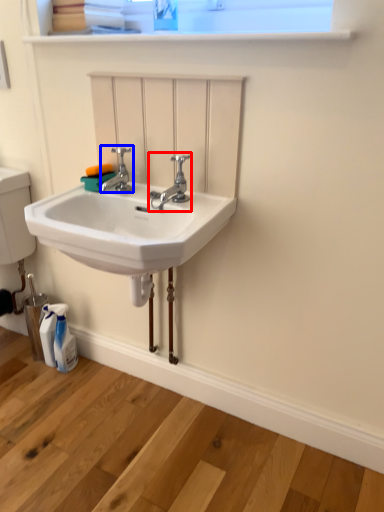
Question: Among these objects, which one is nearest to the camera, tap (highlighted by a red box) or tap (highlighted by a blue box)?

Choices:
 (A) tap
 (B) tap

Answer: (A)